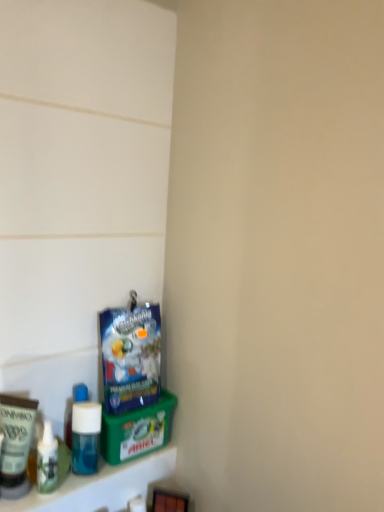
Describe the element at coordinates (130, 357) in the screenshot. I see `blue plastic bag at lower left` at that location.

I want to click on matte cream tube at lower left, the first toiletry viewed from the left, so click(x=15, y=444).

The height and width of the screenshot is (512, 384). What do you see at coordinates (51, 460) in the screenshot?
I see `translucent plastic soap dispenser at lower left, which is the first toiletry from right to left` at bounding box center [51, 460].

Locate an element on the screen. blue plastic bag at lower left is located at coordinates (130, 357).

Is the depth of blue matte bottle at lower left greater than that of translucent plastic soap dispenser at lower left, which is the second toiletry from left to right?

Yes, it is behind translucent plastic soap dispenser at lower left, which is the second toiletry from left to right.

Is point (98, 424) more distant than point (66, 461)?

Yes, it is behind point (66, 461).

From a real-world perspective, is blue matte bottle at lower left on translucent plastic soap dispenser at lower left, which is the first toiletry from right to left?

No, from a real-world perspective, blue matte bottle at lower left is not on top of translucent plastic soap dispenser at lower left, which is the first toiletry from right to left.

Does blue matte bottle at lower left appear on the right side of translucent plastic soap dispenser at lower left, which is the first toiletry from right to left?

Yes, blue matte bottle at lower left is to the right of translucent plastic soap dispenser at lower left, which is the first toiletry from right to left.

Does point (21, 408) appear closer or farther from the camera than point (60, 443)?

Point (21, 408) is positioned closer to the camera compared to point (60, 443).

Based on the photo, visually, is matte cream tube at lower left, the 2th toiletry positioned from the right, positioned to the left or to the right of translucent plastic soap dispenser at lower left, which is the first toiletry from right to left?

Based on their positions, matte cream tube at lower left, the 2th toiletry positioned from the right, is located to the left of translucent plastic soap dispenser at lower left, which is the first toiletry from right to left.

I want to click on toiletry located on the left of translucent plastic soap dispenser at lower left, which is the first toiletry from right to left, so click(15, 444).

Is matte cream tube at lower left, the 2th toiletry positioned from the right, not inside translucent plastic soap dispenser at lower left, which is the second toiletry from left to right?

matte cream tube at lower left, the 2th toiletry positioned from the right, is positioned outside translucent plastic soap dispenser at lower left, which is the second toiletry from left to right.

Locate an element on the screen. The width and height of the screenshot is (384, 512). product above the translucent plastic soap dispenser at lower left, which is the second toiletry from left to right (from the image's perspective) is located at coordinates (130, 357).

Can you confirm if blue plastic bag at lower left is positioned to the left of translucent plastic soap dispenser at lower left, which is the first toiletry from right to left?

In fact, blue plastic bag at lower left is to the right of translucent plastic soap dispenser at lower left, which is the first toiletry from right to left.

How different are the orientations of blue plastic bag at lower left and translucent plastic soap dispenser at lower left, which is the second toiletry from left to right, in degrees?

They differ by 7.7 degrees in their facing directions.

Is blue plastic bag at lower left oriented away from translucent plastic soap dispenser at lower left, which is the second toiletry from left to right?

blue plastic bag at lower left is not turned away from translucent plastic soap dispenser at lower left, which is the second toiletry from left to right.

From their relative heights in the image, would you say translucent plastic soap dispenser at lower left, which is the second toiletry from left to right, is taller or shorter than matte cream tube at lower left, the first toiletry viewed from the left?

Considering their sizes, translucent plastic soap dispenser at lower left, which is the second toiletry from left to right, has less height than matte cream tube at lower left, the first toiletry viewed from the left.

Is translucent plastic soap dispenser at lower left, which is the first toiletry from right to left, inside the boundaries of matte cream tube at lower left, the 2th toiletry positioned from the right, or outside?

translucent plastic soap dispenser at lower left, which is the first toiletry from right to left, cannot be found inside matte cream tube at lower left, the 2th toiletry positioned from the right.

Is translucent plastic soap dispenser at lower left, which is the first toiletry from right to left, directly adjacent to matte cream tube at lower left, the first toiletry viewed from the left?

Yes.

The width and height of the screenshot is (384, 512). What are the coordinates of `toiletry on the left of translucent plastic soap dispenser at lower left, which is the first toiletry from right to left` in the screenshot? It's located at (15, 444).

Is blue matte bottle at lower left at the left side of blue plastic bag at lower left?

Yes.

Can you tell me how much blue matte bottle at lower left and blue plastic bag at lower left differ in facing direction?

The angular difference between blue matte bottle at lower left and blue plastic bag at lower left is 3.36 degrees.

From a real-world perspective, which is physically above, blue matte bottle at lower left or blue plastic bag at lower left?

blue plastic bag at lower left.

Is blue matte bottle at lower left surrounding blue plastic bag at lower left?

That's incorrect, blue plastic bag at lower left is not inside blue matte bottle at lower left.

Where is `product on the right of the blue matte bottle at lower left`? The height and width of the screenshot is (512, 384). product on the right of the blue matte bottle at lower left is located at coordinates [130, 357].

From the image's perspective, is blue plastic bag at lower left located beneath blue matte bottle at lower left?

Incorrect, from the image's perspective, blue plastic bag at lower left is higher than blue matte bottle at lower left.

Who is taller, blue plastic bag at lower left or blue matte bottle at lower left?

blue plastic bag at lower left is taller.

Between blue plastic bag at lower left and blue matte bottle at lower left, which one has larger size?

Bigger between the two is blue plastic bag at lower left.

How different are the orientations of translucent plastic soap dispenser at lower left, which is the first toiletry from right to left, and blue matte bottle at lower left in degrees?

The angular difference between translucent plastic soap dispenser at lower left, which is the first toiletry from right to left, and blue matte bottle at lower left is 4.34 degrees.

Which is nearer, (63, 447) or (88, 471)?

Point (63, 447) is farther from the camera than point (88, 471).

Would you say translucent plastic soap dispenser at lower left, which is the first toiletry from right to left, contains blue matte bottle at lower left?

No, translucent plastic soap dispenser at lower left, which is the first toiletry from right to left, does not contain blue matte bottle at lower left.

Which object is closer to the camera taking this photo, translucent plastic soap dispenser at lower left, which is the second toiletry from left to right, or blue matte bottle at lower left?

translucent plastic soap dispenser at lower left, which is the second toiletry from left to right.

I want to click on the 1st toiletry positioned above the blue matte bottle at lower left (from a real-world perspective), so click(51, 460).

Where is `toiletry below the matte cream tube at lower left, the 2th toiletry positioned from the right (from the image's perspective)`? toiletry below the matte cream tube at lower left, the 2th toiletry positioned from the right (from the image's perspective) is located at coordinates (51, 460).

From the image, which object appears to be farther from blue matte bottle at lower left, translucent plastic soap dispenser at lower left, which is the second toiletry from left to right, or blue plastic bag at lower left?

The object further to blue matte bottle at lower left is blue plastic bag at lower left.

Based on their spatial positions, is matte cream tube at lower left, the 2th toiletry positioned from the right, or translucent plastic soap dispenser at lower left, which is the second toiletry from left to right, further from blue plastic bag at lower left?

matte cream tube at lower left, the 2th toiletry positioned from the right, lies further to blue plastic bag at lower left than the other object.

From the image, which object appears to be farther from matte cream tube at lower left, the first toiletry viewed from the left, blue plastic bag at lower left or translucent plastic soap dispenser at lower left, which is the second toiletry from left to right?

The object further to matte cream tube at lower left, the first toiletry viewed from the left, is blue plastic bag at lower left.

Estimate the real-world distances between objects in this image. Which object is further from blue plastic bag at lower left, matte cream tube at lower left, the 2th toiletry positioned from the right, or blue matte bottle at lower left?

Among the two, matte cream tube at lower left, the 2th toiletry positioned from the right, is located further to blue plastic bag at lower left.

Which object lies further to the anchor point blue matte bottle at lower left, blue plastic bag at lower left or matte cream tube at lower left, the first toiletry viewed from the left?

Based on the image, blue plastic bag at lower left appears to be further to blue matte bottle at lower left.

Looking at the image, which one is located closer to matte cream tube at lower left, the 2th toiletry positioned from the right, translucent plastic soap dispenser at lower left, which is the second toiletry from left to right, or blue plastic bag at lower left?

Based on the image, translucent plastic soap dispenser at lower left, which is the second toiletry from left to right, appears to be nearer to matte cream tube at lower left, the 2th toiletry positioned from the right.

Based on their spatial positions, is matte cream tube at lower left, the first toiletry viewed from the left, or blue matte bottle at lower left closer to translucent plastic soap dispenser at lower left, which is the first toiletry from right to left?

matte cream tube at lower left, the first toiletry viewed from the left, is closer to translucent plastic soap dispenser at lower left, which is the first toiletry from right to left.

When comparing their distances from translucent plastic soap dispenser at lower left, which is the first toiletry from right to left, does blue plastic bag at lower left or matte cream tube at lower left, the 2th toiletry positioned from the right, seem further?

Based on the image, blue plastic bag at lower left appears to be further to translucent plastic soap dispenser at lower left, which is the first toiletry from right to left.

This screenshot has height=512, width=384. In order to click on toiletry between matte cream tube at lower left, the 2th toiletry positioned from the right, and blue plastic bag at lower left from left to right in this screenshot , I will do `click(51, 460)`.

I want to click on bottle situated between matte cream tube at lower left, the 2th toiletry positioned from the right, and blue plastic bag at lower left from left to right, so click(x=85, y=437).

Find the location of a particular element. toiletry between matte cream tube at lower left, the first toiletry viewed from the left, and blue matte bottle at lower left is located at coordinates (51, 460).